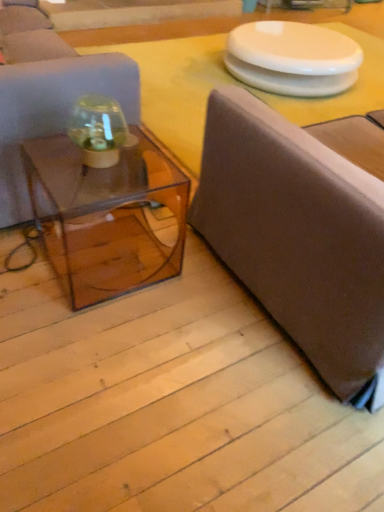
Identify the location of vacant area situated to the left side of white glossy round table at upper center. Image resolution: width=384 pixels, height=512 pixels. pos(180,67).